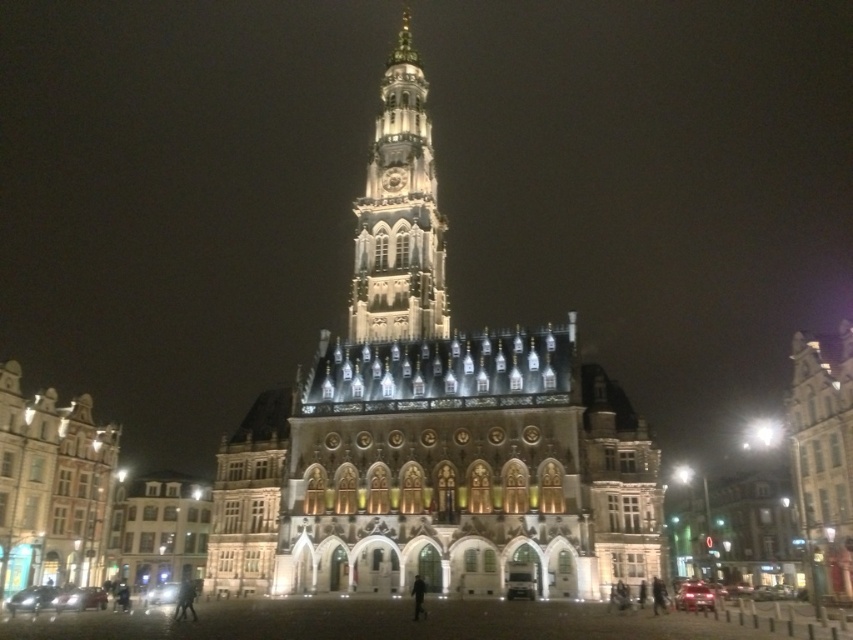
Question: Among these objects, which one is farthest from the camera?

Choices:
 (A) illuminated stone clock tower at center
 (B) illuminated stone church at center

Answer: (A)

Question: Does illuminated stone church at center appear on the right side of illuminated stone clock tower at center?

Choices:
 (A) no
 (B) yes

Answer: (A)

Question: Is illuminated stone church at center smaller than illuminated stone clock tower at center?

Choices:
 (A) no
 (B) yes

Answer: (A)

Question: Which is nearer to the illuminated stone church at center?

Choices:
 (A) polished stone town square at center
 (B) illuminated stone clock tower at center

Answer: (B)

Question: Which object is closer to the camera taking this photo?

Choices:
 (A) polished stone town square at center
 (B) illuminated stone clock tower at center
 (C) illuminated stone church at center

Answer: (A)

Question: Is the position of polished stone town square at center more distant than that of illuminated stone church at center?

Choices:
 (A) no
 (B) yes

Answer: (A)